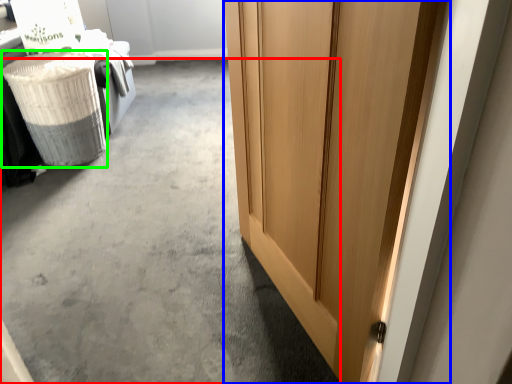
Question: Which object is the closest to the concrete (highlighted by a red box)? Choose among these: door (highlighted by a blue box) or laundry basket (highlighted by a green box).

Choices:
 (A) door
 (B) laundry basket

Answer: (B)